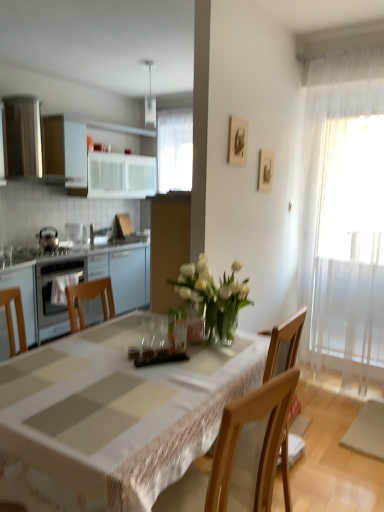
Question: Considering the positions of point (132, 276) and point (61, 158), is point (132, 276) closer or farther from the camera than point (61, 158)?

Choices:
 (A) closer
 (B) farther

Answer: (B)

Question: Is matte white cabinets at left, placed as the 2th cabinetry when sorted from top to bottom, bigger or smaller than white glossy cabinets at upper left, the 2th cabinetry positioned from the bottom?

Choices:
 (A) big
 (B) small

Answer: (A)

Question: Which object is positioned closest to the wooden picture frame at upper right, the first picture frame in the right-to-left sequence?

Choices:
 (A) white sheer curtain at right
 (B) white clothed table at center
 (C) satin silver oven at left
 (D) white glossy cabinets at upper left, the 2th cabinetry positioned from the bottom
 (E) satin silver oven at left

Answer: (A)

Question: Which object is positioned closest to the satin silver oven at left?

Choices:
 (A) matte white cabinets at left, placed as the 2th cabinetry when sorted from top to bottom
 (B) wooden picture frame at upper center, the 1th picture frame viewed from the front
 (C) white glass vase at center
 (D) wooden picture frame at upper right, acting as the second picture frame starting from the left
 (E) satin silver oven at left

Answer: (E)